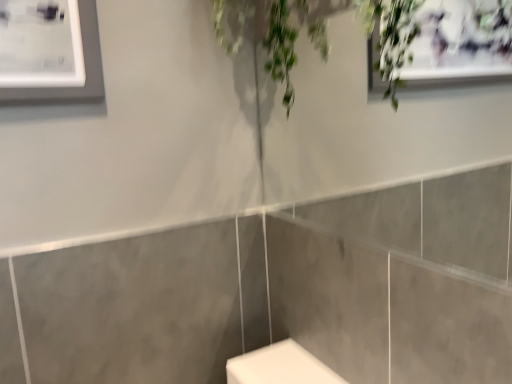
This screenshot has width=512, height=384. Describe the element at coordinates (316, 33) in the screenshot. I see `green leafy plant at upper center` at that location.

Image resolution: width=512 pixels, height=384 pixels. I want to click on green leafy plant at upper center, so click(316, 33).

Where is `green leafy plant at upper center`? green leafy plant at upper center is located at coordinates (316, 33).